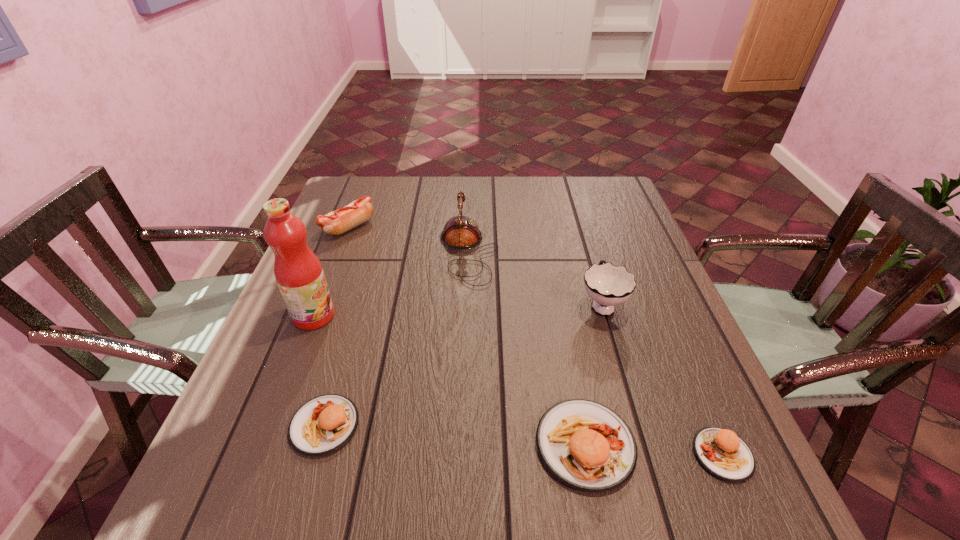
This screenshot has height=540, width=960. What are the coordinates of `free space located 0.150m on the right of the second shortest object` in the screenshot? It's located at (441, 425).

Image resolution: width=960 pixels, height=540 pixels. I want to click on free spot located on the left of the second patty from right to left, so click(400, 444).

Where is `vacant region located on the back of the rightmost object`? The height and width of the screenshot is (540, 960). vacant region located on the back of the rightmost object is located at coordinates (670, 333).

The image size is (960, 540). I want to click on vacant point located 0.390m on the front label of the fruit juice, so click(504, 316).

The width and height of the screenshot is (960, 540). Find the location of `vacant space located 0.220m on the right of the sausage`. vacant space located 0.220m on the right of the sausage is located at coordinates (448, 227).

Where is `free space located 0.270m on the rotary dial of the fourth object from right to left`? free space located 0.270m on the rotary dial of the fourth object from right to left is located at coordinates (598, 252).

This screenshot has width=960, height=540. I want to click on blank area located on the side of the cup with the handle, so click(x=571, y=199).

Locate an element on the screen. Image resolution: width=960 pixels, height=540 pixels. vacant space located 0.280m on the side of the cup with the handle is located at coordinates (577, 220).

You are a GUI agent. You are given a task and a screenshot of the screen. Output one action in this format:
    pyautogui.click(x=<x>, y=<y>)
    Task: Click on the vacant space situated on the side of the cup with the handle
    The image size is (960, 540).
    Given the screenshot: What is the action you would take?
    pyautogui.click(x=588, y=256)

This screenshot has width=960, height=540. In order to click on object at the far edge in this screenshot , I will do `click(341, 220)`.